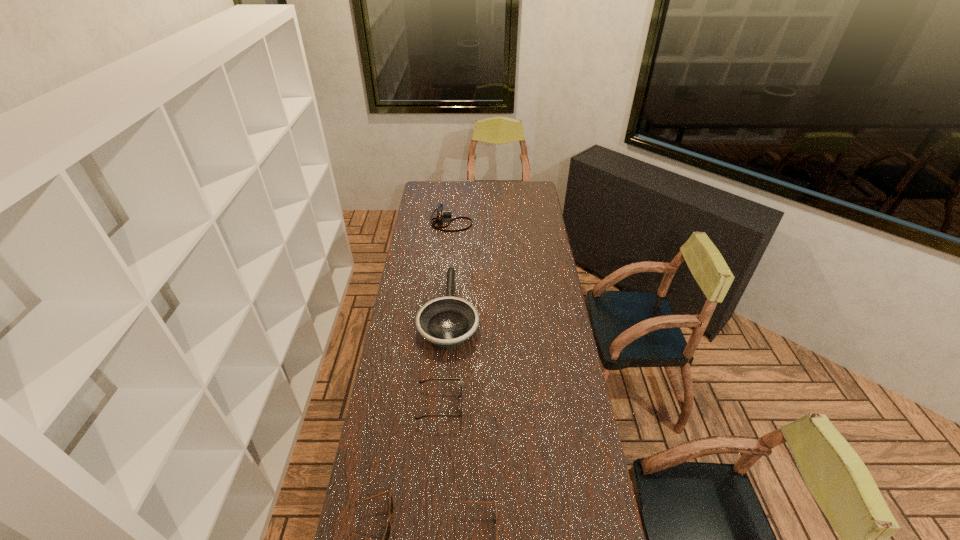
The image size is (960, 540). What are the coordinates of `sunglasses situated at the left edge` in the screenshot? It's located at (420, 382).

Where is `blank space at the far edge`? Image resolution: width=960 pixels, height=540 pixels. blank space at the far edge is located at coordinates (497, 189).

The image size is (960, 540). In order to click on free space at the left edge in this screenshot , I will do click(x=376, y=499).

Identify the location of vacant region at the right edge of the desktop. This screenshot has width=960, height=540. (526, 210).

I want to click on blank space at the far left corner of the desktop, so click(x=425, y=197).

Where is `free spot between the camera and the fourth nearest object`? Image resolution: width=960 pixels, height=540 pixels. free spot between the camera and the fourth nearest object is located at coordinates (450, 266).

Identify the location of free space between the frying pan and the third farthest object. (444, 357).

Identify the location of free spot between the third nearest object and the frying pan. The height and width of the screenshot is (540, 960). (444, 357).

This screenshot has width=960, height=540. I want to click on unoccupied area between the second farthest object and the farthest sunglasses, so click(444, 357).

Locate an element on the screen. The width and height of the screenshot is (960, 540). blank region between the camera and the frying pan is located at coordinates (450, 266).